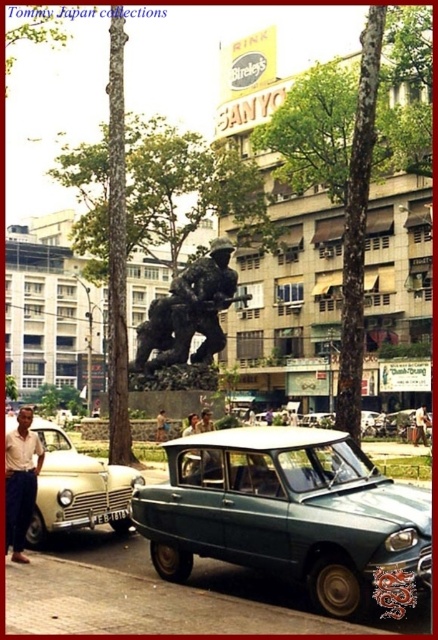
Does light beige shirt at lower left have a smaller size compared to green plastic license plate at center?

Actually, light beige shirt at lower left might be larger than green plastic license plate at center.

The height and width of the screenshot is (640, 438). Describe the element at coordinates (21, 481) in the screenshot. I see `light beige shirt at lower left` at that location.

Locate an element on the screen. The width and height of the screenshot is (438, 640). light beige shirt at lower left is located at coordinates (21, 481).

Who is higher up, green leafy tree at center or green plastic license plate at center?

green leafy tree at center

At what (x,y) coordinates should I click in order to perform the action: click on green leafy tree at center. Please return your answer as a coordinate pair (x, y). The width and height of the screenshot is (438, 640). Looking at the image, I should click on (187, 188).

Where is `green leafy tree at center`? green leafy tree at center is located at coordinates (187, 188).

In the scene shown: Between bronze statue at center and light beige shirt at lower left, which one has less height?

With less height is light beige shirt at lower left.

Between bronze statue at center and light beige shirt at lower left, which one has more height?

With more height is bronze statue at center.

This screenshot has width=438, height=640. What are the coordinates of `bronze statue at center` in the screenshot? It's located at (189, 312).